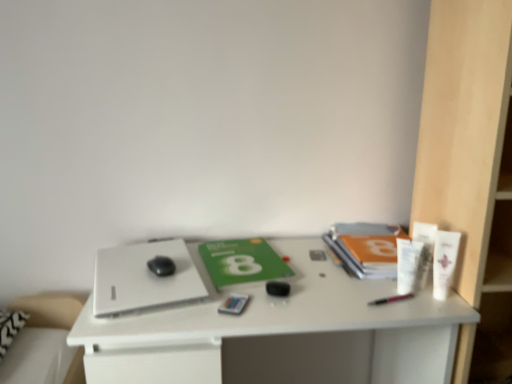
The width and height of the screenshot is (512, 384). Identify the location of free space to the right of green matte paperback book at center, the first paperback book viewed from the left. (317, 273).